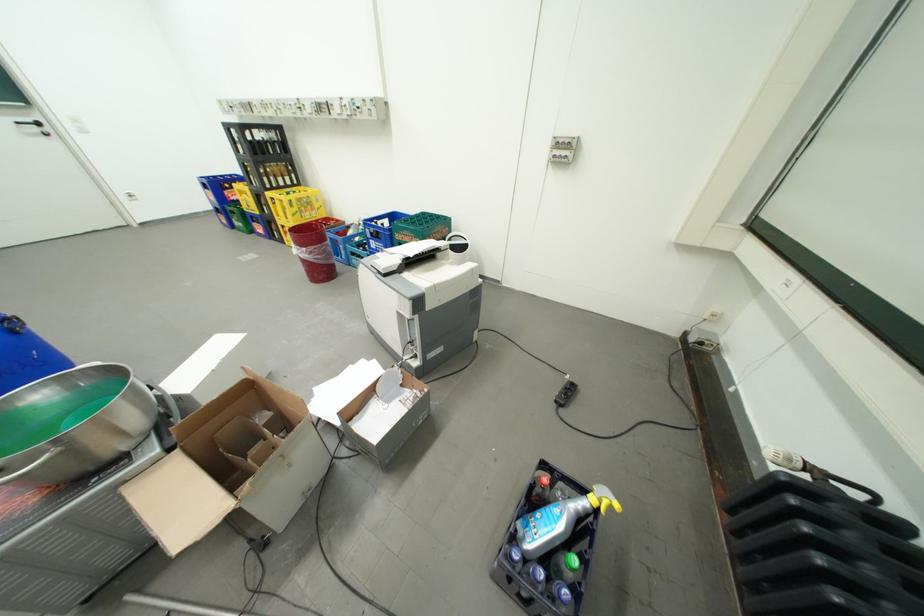
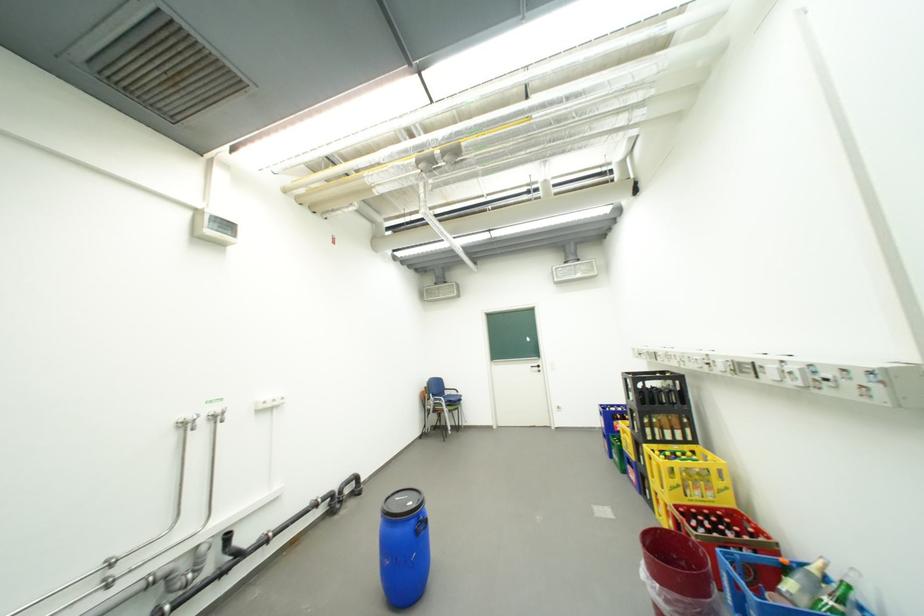
First-person continuous shooting, in which direction is the camera rotating?

The camera rotated toward left-up.